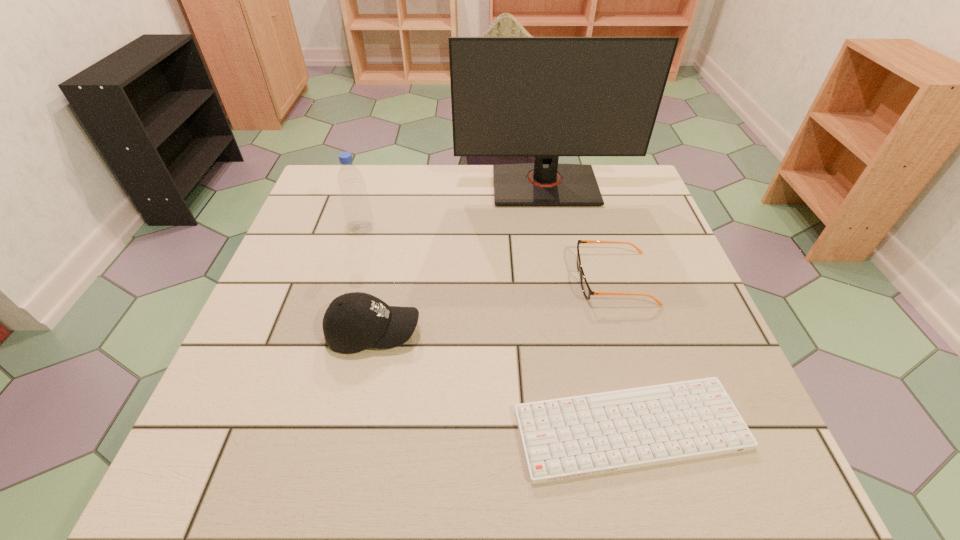
Where is `baseball cap present at the left edge`? baseball cap present at the left edge is located at coordinates (353, 322).

Where is `monitor located in the right edge section of the desktop`? monitor located in the right edge section of the desktop is located at coordinates (546, 97).

The height and width of the screenshot is (540, 960). In order to click on spectacles located in the right edge section of the desktop in this screenshot , I will do `click(587, 291)`.

The width and height of the screenshot is (960, 540). What are the coordinates of `computer keyboard that is positioned at the right edge` in the screenshot? It's located at (564, 438).

Find the location of a particular element. object that is at the far right corner is located at coordinates (546, 97).

This screenshot has height=540, width=960. Find the location of `object that is at the near right corner`. object that is at the near right corner is located at coordinates (564, 438).

I want to click on free space at the far edge of the desktop, so (x=447, y=200).

The image size is (960, 540). Find the location of `blank area at the near edge`. blank area at the near edge is located at coordinates (524, 458).

Identify the location of vacant region at the left edge of the desktop. (287, 406).

Find the location of a particular element. The width and height of the screenshot is (960, 540). vacant space at the right edge is located at coordinates (704, 333).